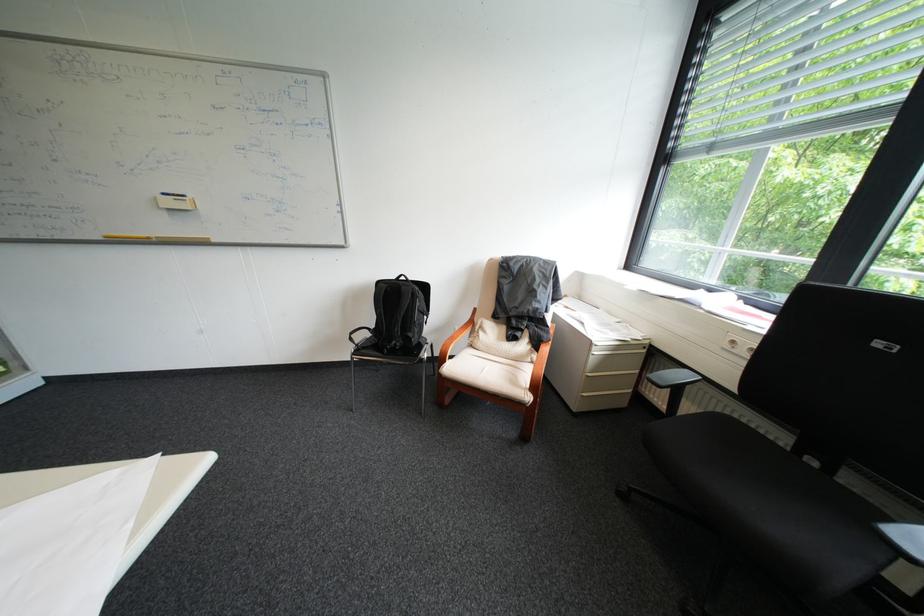
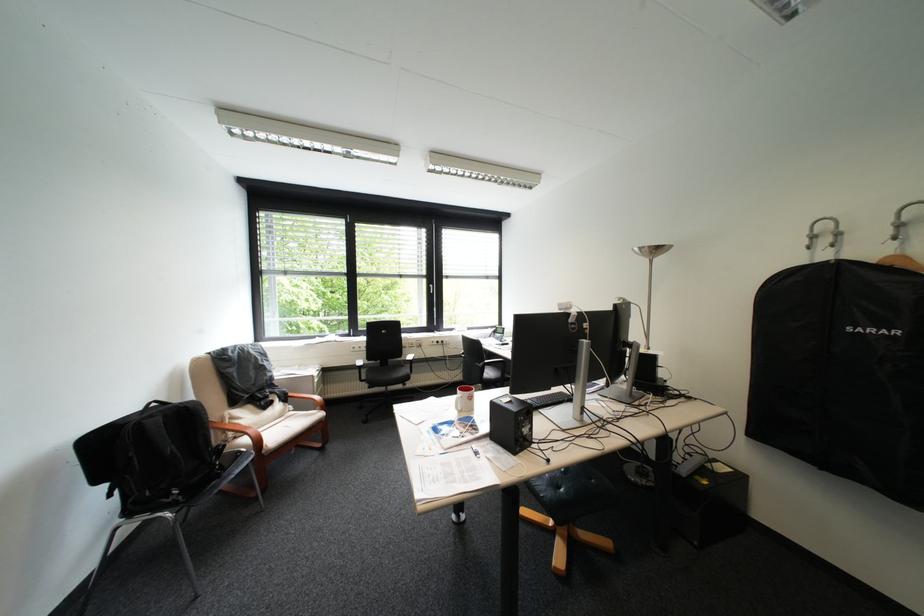
In the second image, find the point that corresponds to the point at 415,288 in the first image.

(199, 407)